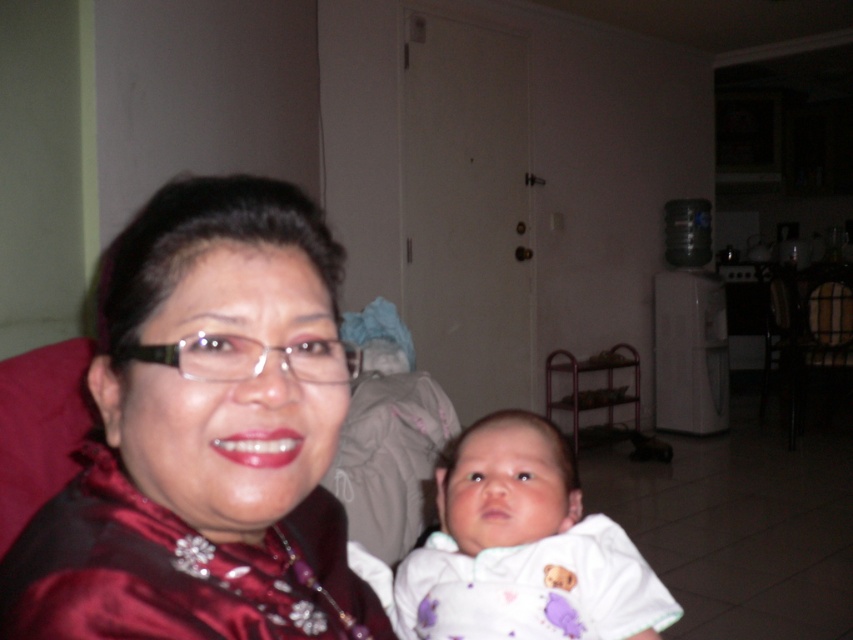
You are a photographer setting up for a portrait. The subject is the satin red blouse at left and the white soft fabric baby at center. You need to ensure there is at least 10 inches between them for proper lighting. Is the current distance sufficient?

The satin red blouse at left is 12.50 inches away from the white soft fabric baby at center, which is more than the required 10 inches, so the distance is sufficient for proper lighting.

You are a photographer trying to focus on the baby in the center. To avoid distractions, you need to ensure the baby is not overlapping with the satin red blouse at left. Based on their positions, is the baby positioned to the right or left of the blouse?

The baby is positioned to the right of the satin red blouse at left because the baby is at center right and the blouse is at left.